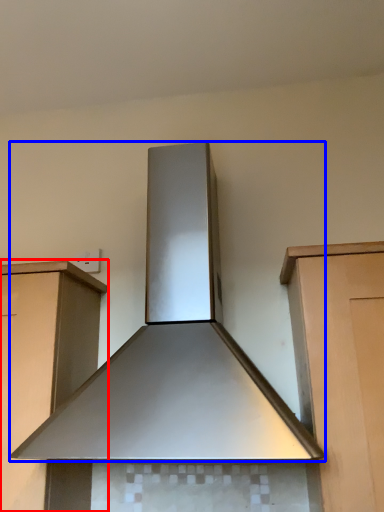
Question: Which object appears closest to the camera in this image, cabinetry (highlighted by a red box) or home appliance (highlighted by a blue box)?

Choices:
 (A) cabinetry
 (B) home appliance

Answer: (B)